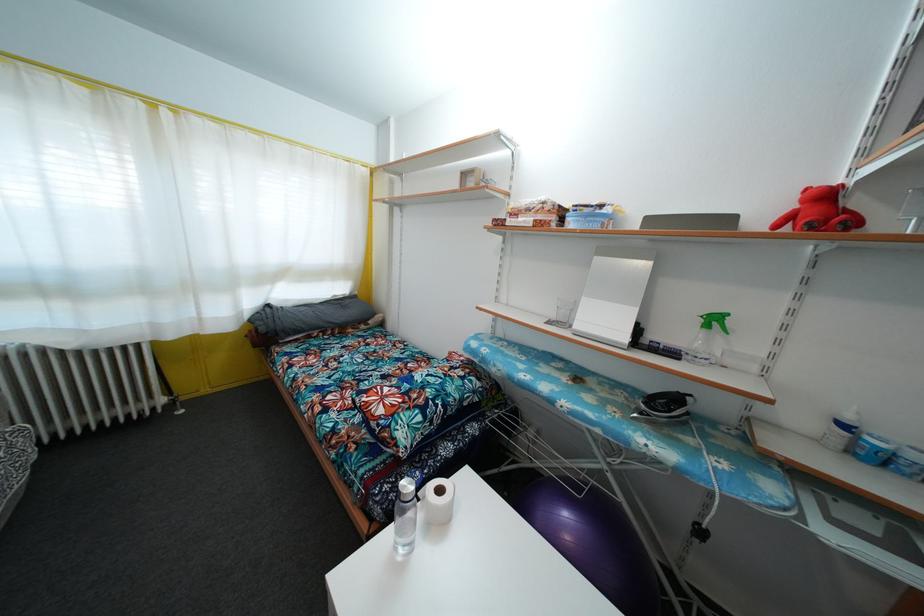
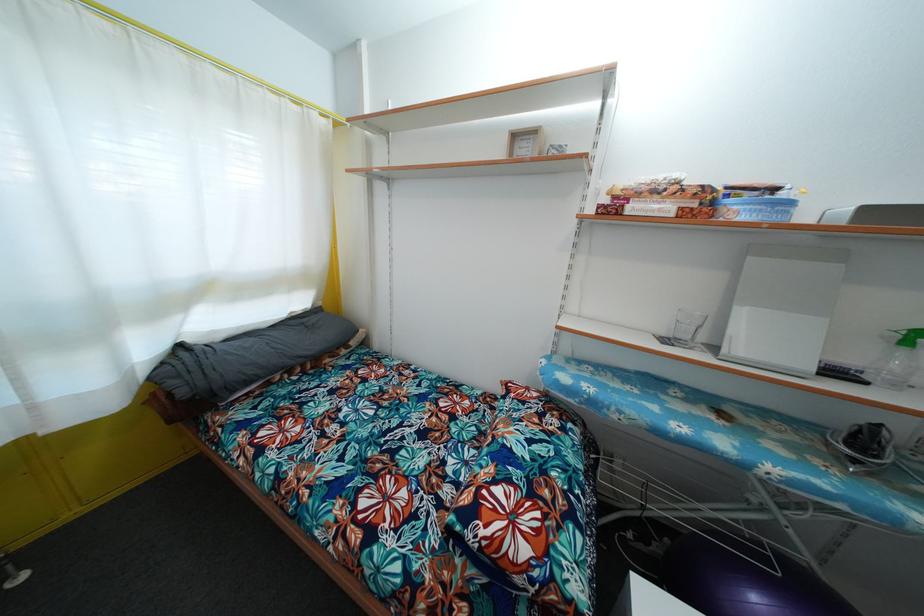
Question: How did the camera likely rotate?

Choices:
 (A) Left
 (B) Right
 (C) Up
 (D) Down

Answer: (B)